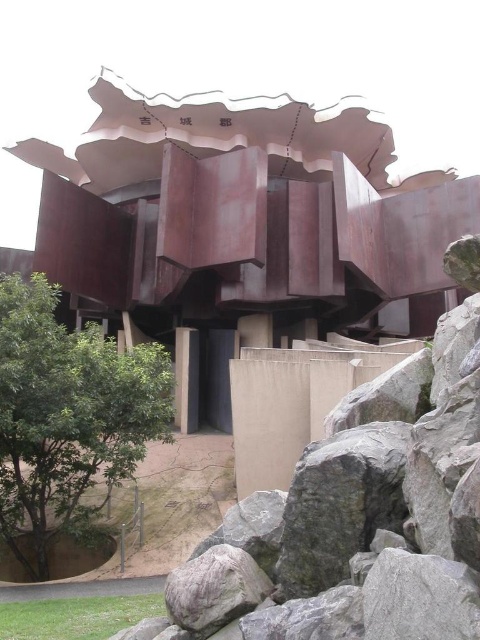
Question: Is rusty metal structure at center positioned behind green leafy tree at lower left?

Choices:
 (A) no
 (B) yes

Answer: (B)

Question: Which of the following is the farthest from the observer?

Choices:
 (A) (149, 397)
 (B) (256, 218)

Answer: (B)

Question: Observing the image, what is the correct spatial positioning of rusty metal structure at center in reference to green leafy tree at lower left?

Choices:
 (A) above
 (B) below

Answer: (A)

Question: Can you confirm if rusty metal structure at center is wider than green leafy tree at lower left?

Choices:
 (A) yes
 (B) no

Answer: (A)